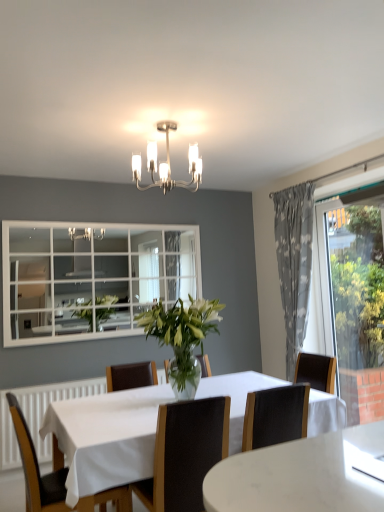
Question: Which direction should I rotate to look at black leather chair at center, which ranks as the second chair in left-to-right order, — up or down?

Choices:
 (A) up
 (B) down

Answer: (B)

Question: Is white marble table at center in contact with metallic chandelier at upper center?

Choices:
 (A) yes
 (B) no

Answer: (B)

Question: Would you consider white marble table at center to be distant from metallic chandelier at upper center?

Choices:
 (A) yes
 (B) no

Answer: (A)

Question: Is white marble table at center oriented towards metallic chandelier at upper center?

Choices:
 (A) no
 (B) yes

Answer: (A)

Question: Does white marble table at center have a larger size compared to metallic chandelier at upper center?

Choices:
 (A) no
 (B) yes

Answer: (B)

Question: Considering the relative positions of white marble table at center and metallic chandelier at upper center in the image provided, is white marble table at center behind metallic chandelier at upper center?

Choices:
 (A) no
 (B) yes

Answer: (A)

Question: Does white marble table at center have a greater height compared to metallic chandelier at upper center?

Choices:
 (A) no
 (B) yes

Answer: (B)

Question: Can you confirm if black leather chair at center, which ranks as the 1th chair in right-to-left order, is positioned to the left of transparent glass window at right?

Choices:
 (A) yes
 (B) no

Answer: (A)

Question: Considering the relative positions of black leather chair at center, which ranks as the second chair in left-to-right order, and transparent glass window at right in the image provided, is black leather chair at center, which ranks as the second chair in left-to-right order, in front of transparent glass window at right?

Choices:
 (A) no
 (B) yes

Answer: (B)

Question: Is black leather chair at center, which ranks as the 1th chair in right-to-left order, positioned with its back to transparent glass window at right?

Choices:
 (A) yes
 (B) no

Answer: (B)

Question: Considering the relative sizes of black leather chair at center, which ranks as the 1th chair in right-to-left order, and transparent glass window at right in the image provided, is black leather chair at center, which ranks as the 1th chair in right-to-left order, bigger than transparent glass window at right?

Choices:
 (A) no
 (B) yes

Answer: (A)

Question: Is black leather chair at center, which ranks as the 1th chair in right-to-left order, to the right of transparent glass window at right from the viewer's perspective?

Choices:
 (A) no
 (B) yes

Answer: (A)

Question: Would you consider black leather chair at center, which ranks as the 1th chair in right-to-left order, to be distant from transparent glass window at right?

Choices:
 (A) no
 (B) yes

Answer: (B)

Question: Can you confirm if white marble table at center is shorter than transparent glass window at right?

Choices:
 (A) no
 (B) yes

Answer: (B)